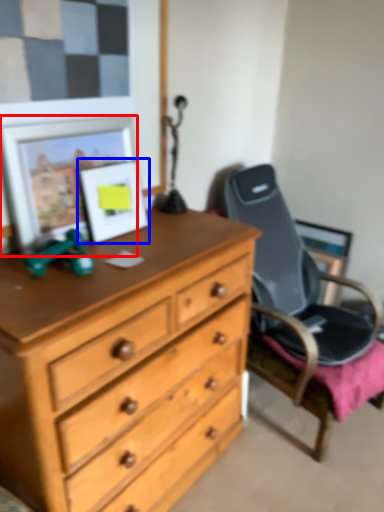
Question: Which object is further to the camera taking this photo, picture frame (highlighted by a red box) or picture frame (highlighted by a blue box)?

Choices:
 (A) picture frame
 (B) picture frame

Answer: (B)